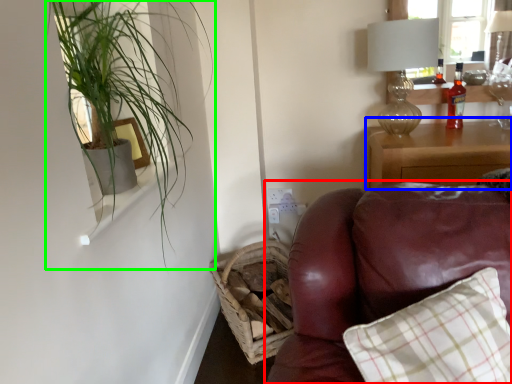
Question: Considering the real-world distances, which object is closest to studio couch (highlighted by a red box)? nightstand (highlighted by a blue box) or houseplant (highlighted by a green box).

Choices:
 (A) nightstand
 (B) houseplant

Answer: (B)